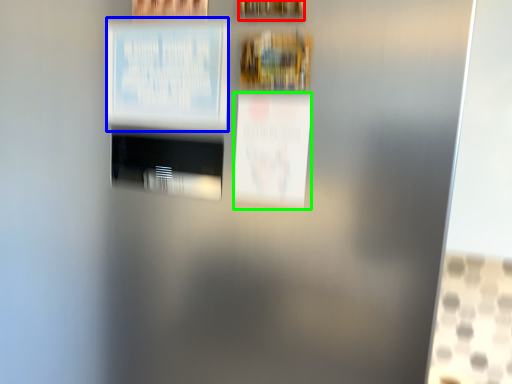
Question: Estimate the real-world distances between objects in this image. Which object is closer to picture frame (highlighted by a red box), poster (highlighted by a blue box) or poster (highlighted by a green box)?

Choices:
 (A) poster
 (B) poster

Answer: (A)